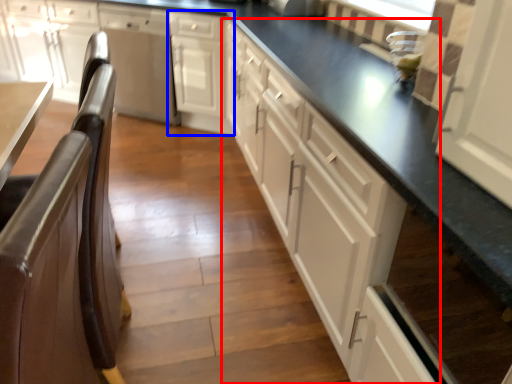
Question: Which of the following is the farthest to the observer, cabinetry (highlighted by a red box) or cabinetry (highlighted by a blue box)?

Choices:
 (A) cabinetry
 (B) cabinetry

Answer: (B)